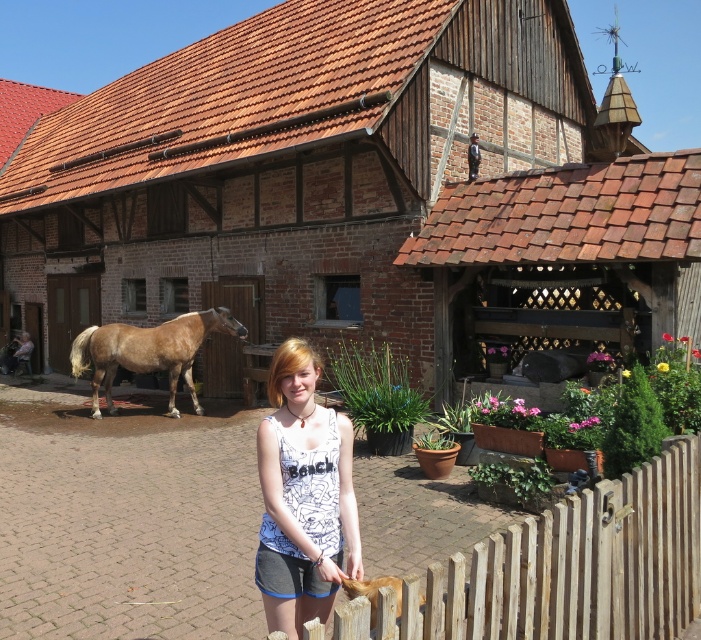
You are a photographer standing in front of the scene. You want to take a photo of the brown wooden barn at center and the brown glossy horse at center. Which object will appear larger in the photo?

The brown wooden barn at center will appear larger in the photo because it is closer to the viewer than the brown glossy horse at center.

You are a photographer trying to capture the light brown wooden fence at lower right in your shot. Based on its 2D coordinates, where should you position your camera to ensure it appears in the lower right corner of the image?

The light brown wooden fence at lower right is located at coordinates point (566,568), so positioning the camera to frame the lower right corner around these coordinates will ensure the fence is captured there.

You are a photographer trying to capture the brown glossy horse at center and the light brown wooden fence at lower right in the same frame. Based on their heights, which object will appear taller in the photo?

The brown glossy horse at center will appear taller in the photo because it is taller than the light brown wooden fence at lower right.